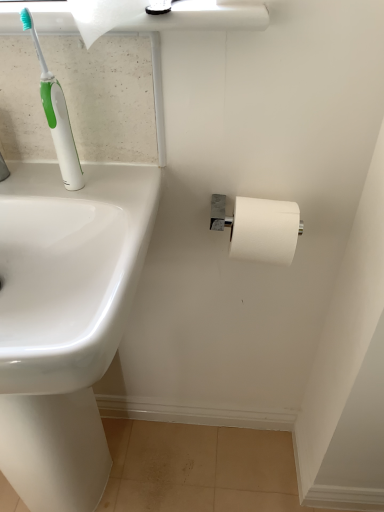
Question: Is point (299, 231) closer or farther from the camera than point (3, 343)?

Choices:
 (A) farther
 (B) closer

Answer: (A)

Question: Considering the relative positions of white matte toilet paper at right, which is the 1th toilet paper in right-to-left order, and white glossy sink at left in the image provided, is white matte toilet paper at right, which is the 1th toilet paper in right-to-left order, to the left or to the right of white glossy sink at left?

Choices:
 (A) right
 (B) left

Answer: (A)

Question: Considering the real-world distances, which object is closest to the white matte toilet paper at right, positioned as the first toilet paper in bottom-to-top order?

Choices:
 (A) white glossy sink at left
 (B) white matte toilet paper at upper left, which is the first toilet paper in left-to-right order
 (C) green plastic toothbrush at upper left

Answer: (C)

Question: Estimate the real-world distances between objects in this image. Which object is closer to the white matte toilet paper at right, the 2th toilet paper when ordered from left to right?

Choices:
 (A) green plastic toothbrush at upper left
 (B) white glossy sink at left
 (C) white matte toilet paper at upper left, marked as the first toilet paper in a front-to-back arrangement

Answer: (A)